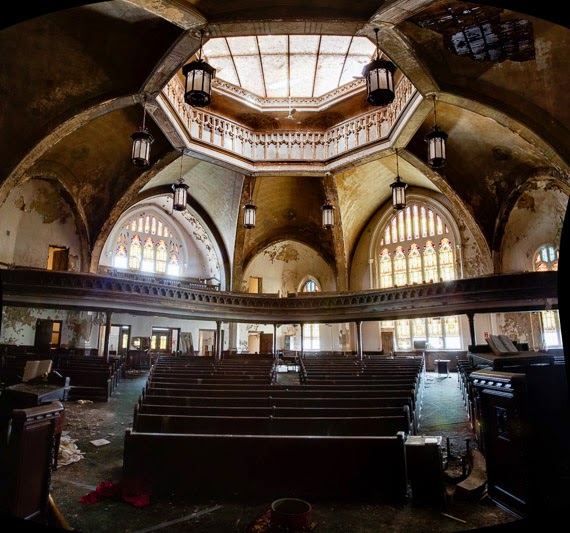
At what (x,y) coordinates should I click in order to perform the action: click on bulb glass. Please return your answer as a coordinate pair (x, y). Looking at the image, I should click on (198, 78).